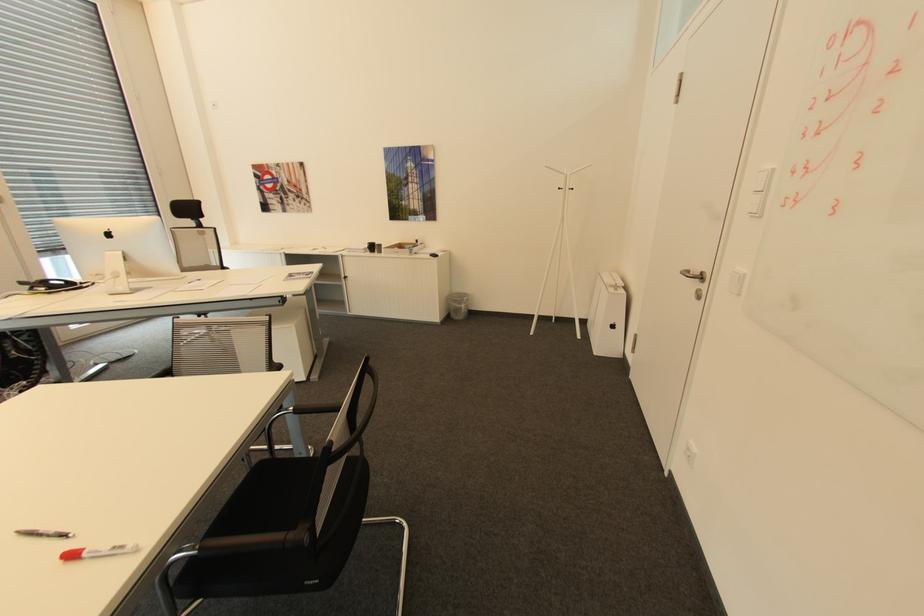
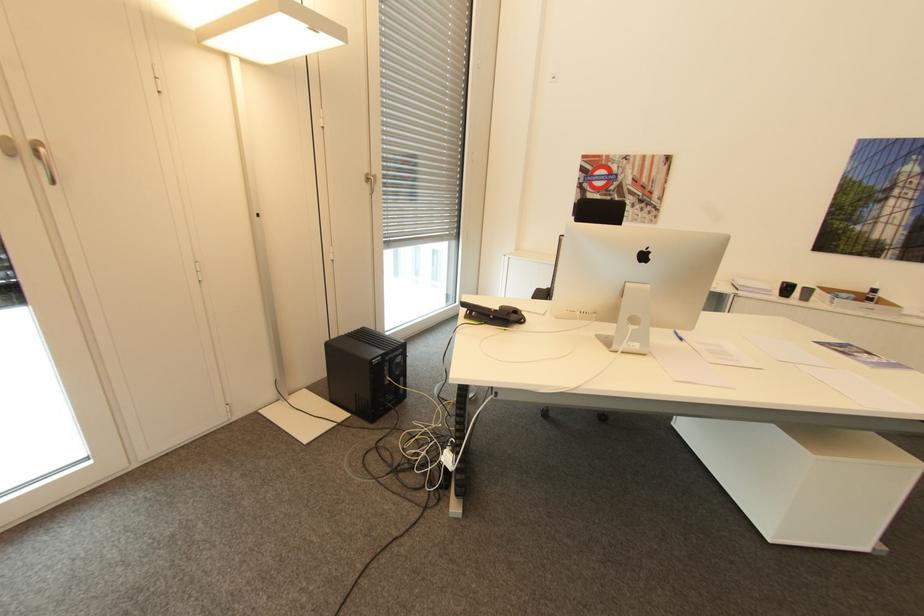
Where in the second image is the point corresponding to point (70, 281) from the first image?

(520, 310)